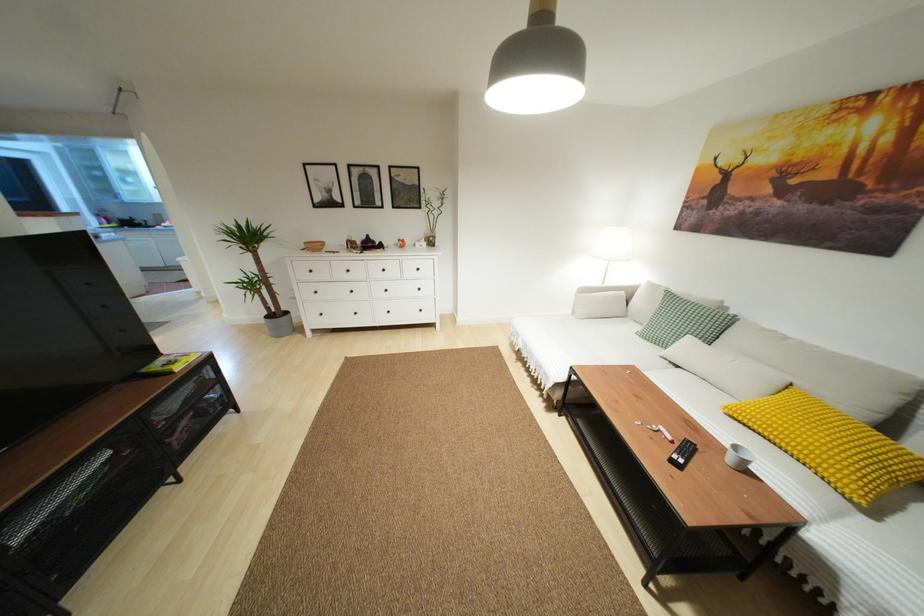
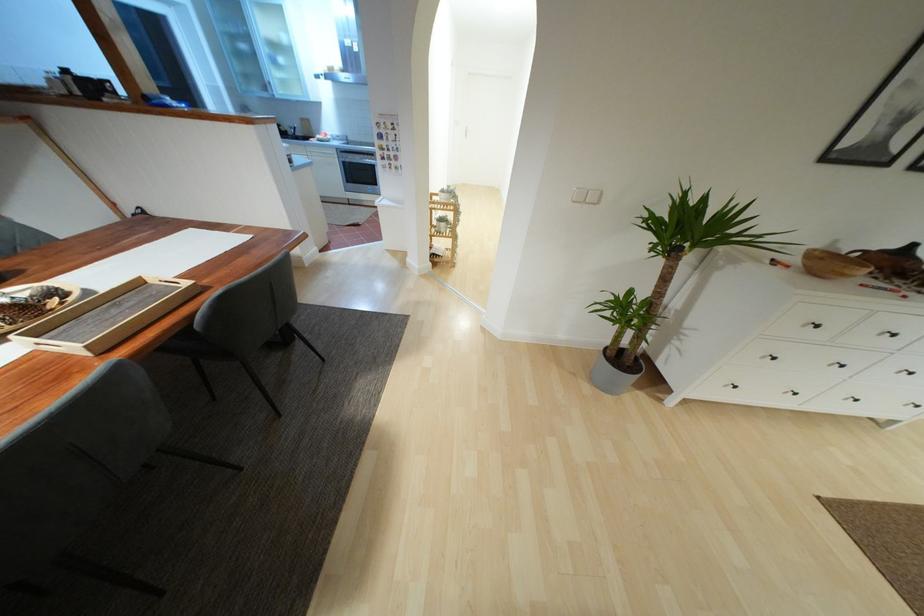
Find the pixel in the second image that matches (x=314, y=292) in the first image.

(773, 358)